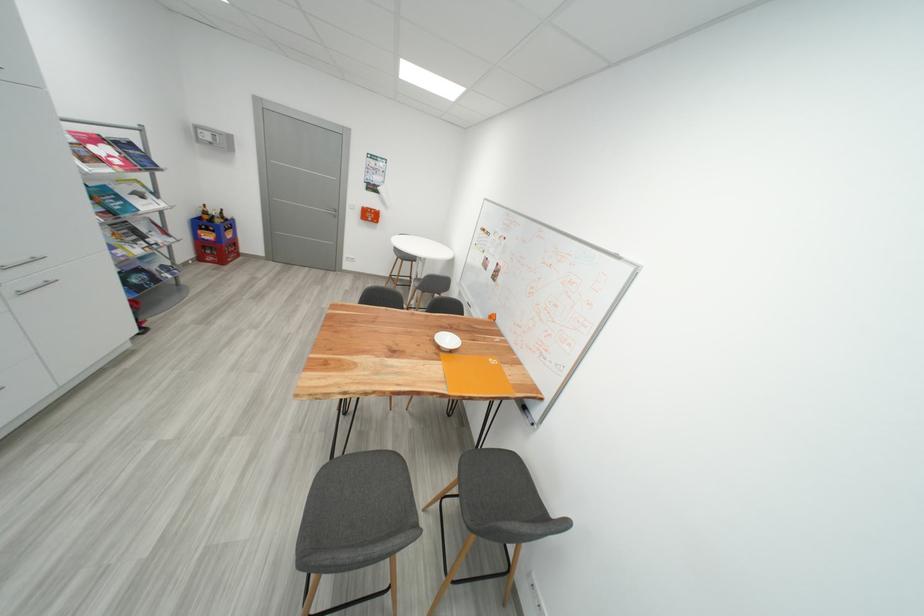
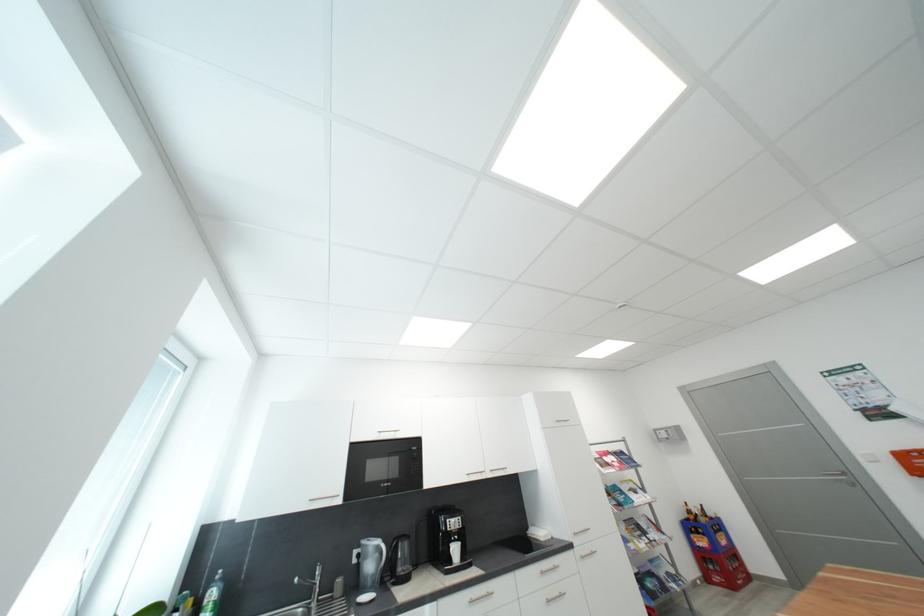
Find the pixel in the second image that matches (x=225, y=223) in the first image.

(710, 522)